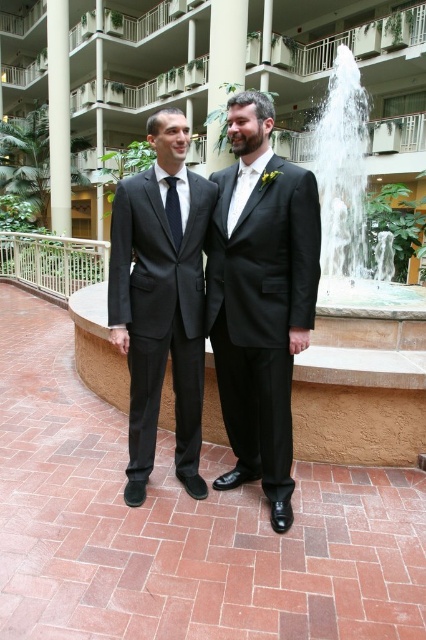
Question: Is shiny black suit at center closer to camera compared to matte black suit at left?

Choices:
 (A) yes
 (B) no

Answer: (A)

Question: Which point is closer to the camera?

Choices:
 (A) (400, 314)
 (B) (187, 337)
 (C) (54, 33)

Answer: (B)

Question: In this image, where is white glossy pillar at left located relative to black silk tie at center?

Choices:
 (A) left
 (B) right

Answer: (A)

Question: Which point is farther to the camera?

Choices:
 (A) white stone fountain at center
 (B) white glossy pillar at left
 (C) matte black suit at left

Answer: (B)

Question: Does matte black suit at center have a larger size compared to black silk tie at center?

Choices:
 (A) no
 (B) yes

Answer: (B)

Question: Which object appears farthest from the camera in this image?

Choices:
 (A) black silk tie at center
 (B) white glossy pillar at left

Answer: (B)